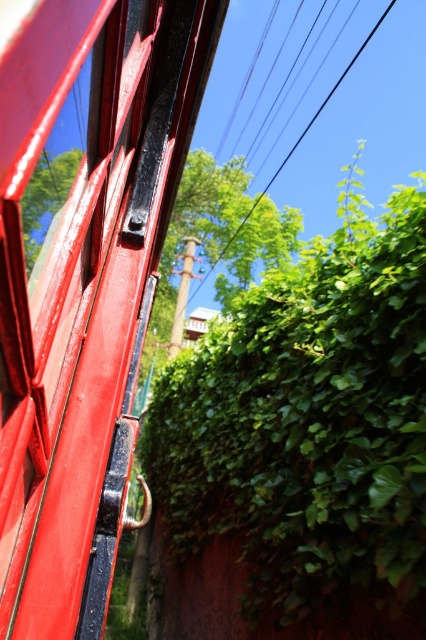
You are looking through the red metal structure and want to know the exact position of the green leafy tree at center. Can you tell me its coordinates?

The green leafy tree at center is located at coordinates point (x=218, y=240).

You are a painter wanting to capture the scene through the shiny red metal train window at left and the green leafy hedge at center. Which object would you focus on if you want to emphasize the contrast between the two in your painting?

The shiny red metal train window at left has a smaller size compared to the green leafy hedge at center, so focusing on the smaller window and the larger hedge would highlight their contrasting sizes and colors effectively.